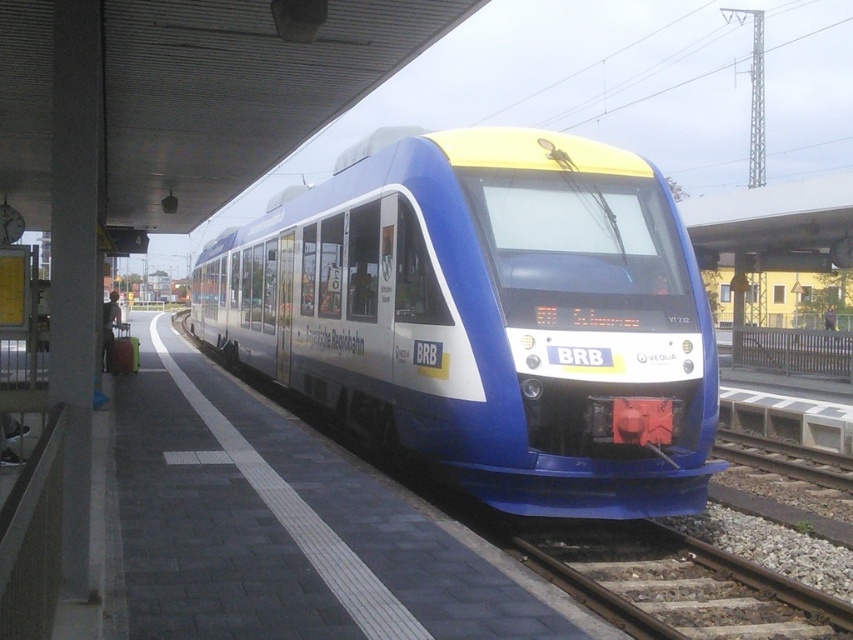
Question: Does blue glossy train at center appear on the left side of matte blue train at center?

Choices:
 (A) yes
 (B) no

Answer: (B)

Question: Can you confirm if blue glossy train at center is smaller than matte blue train at center?

Choices:
 (A) yes
 (B) no

Answer: (B)

Question: Which object appears closest to the camera in this image?

Choices:
 (A) matte blue train at center
 (B) brown wooden train track at lower right

Answer: (B)

Question: Which of the following is the farthest from the observer?

Choices:
 (A) (x=108, y=362)
 (B) (x=482, y=228)
 (C) (x=556, y=557)

Answer: (A)

Question: Which object is closer to the camera taking this photo?

Choices:
 (A) blue glossy train at center
 (B) brown wooden train track at lower right
 (C) matte blue train at center

Answer: (B)

Question: Is blue glossy train at center positioned in front of matte blue train at center?

Choices:
 (A) yes
 (B) no

Answer: (A)